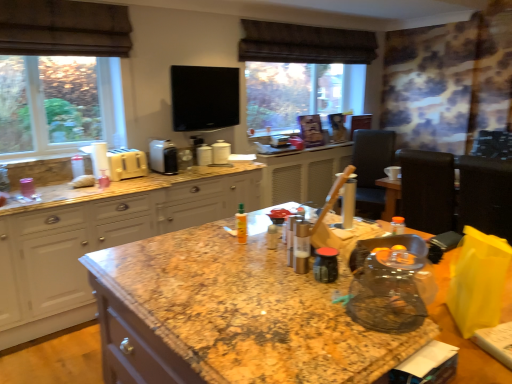
Question: Considering the relative positions of yellow matte bottle at center and matte granite countertop at left in the image provided, is yellow matte bottle at center to the left or to the right of matte granite countertop at left?

Choices:
 (A) left
 (B) right

Answer: (B)

Question: Considering their positions, is yellow matte bottle at center located in front of or behind matte granite countertop at left?

Choices:
 (A) behind
 (B) front

Answer: (B)

Question: Which object is positioned farthest from the white plastic toaster at center, marked as the 2th appliance in a left-to-right arrangement?

Choices:
 (A) yellow matte bottle at center
 (B) yellow plastic toaster at left, which is the 4th appliance in right-to-left order
 (C) white glossy canister at center, arranged as the 1th appliance when viewed from the right
 (D) white glossy canisters at center, arranged as the 3th appliance when viewed from the left
 (E) granite countertop at center

Answer: (A)

Question: Which object is the closest to the white glossy canister at center, marked as the 4th appliance in a left-to-right arrangement?

Choices:
 (A) white plastic toaster at center, which is the 3th appliance from right to left
 (B) granite countertop at center
 (C) matte granite countertop at left
 (D) granite at center
 (E) bread dough at left

Answer: (A)